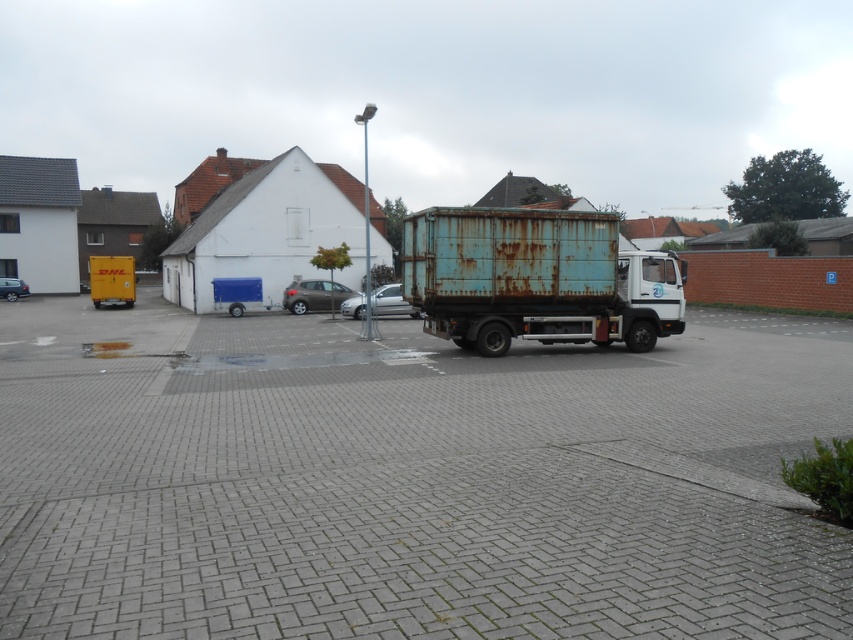
The width and height of the screenshot is (853, 640). Identify the location of silver metallic car at center. (392, 301).

What do you see at coordinates (392, 301) in the screenshot? I see `silver metallic car at center` at bounding box center [392, 301].

Locate an element on the screen. Image resolution: width=853 pixels, height=640 pixels. silver metallic car at center is located at coordinates (392, 301).

Can you confirm if yellow matte truck at left is positioned above silver metallic car at center?

Yes, yellow matte truck at left is above silver metallic car at center.

Is point (107, 296) more distant than point (384, 304)?

Yes, it is.

The width and height of the screenshot is (853, 640). Find the location of `yellow matte truck at left`. yellow matte truck at left is located at coordinates (111, 280).

Does point (482, 282) lie behind point (300, 305)?

No, (482, 282) is in front of (300, 305).

Can you confirm if rusty metal truck at center is shorter than satin brown hatchback at center?

Correct, rusty metal truck at center is not as tall as satin brown hatchback at center.

Where is `rusty metal truck at center`? Image resolution: width=853 pixels, height=640 pixels. rusty metal truck at center is located at coordinates (534, 278).